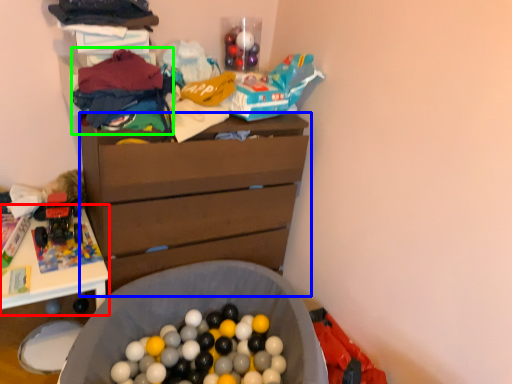
Question: Which object is positioned farthest from table (highlighted by a red box)? Select from chest of drawers (highlighted by a blue box) and clothing (highlighted by a green box).

Choices:
 (A) chest of drawers
 (B) clothing

Answer: (B)